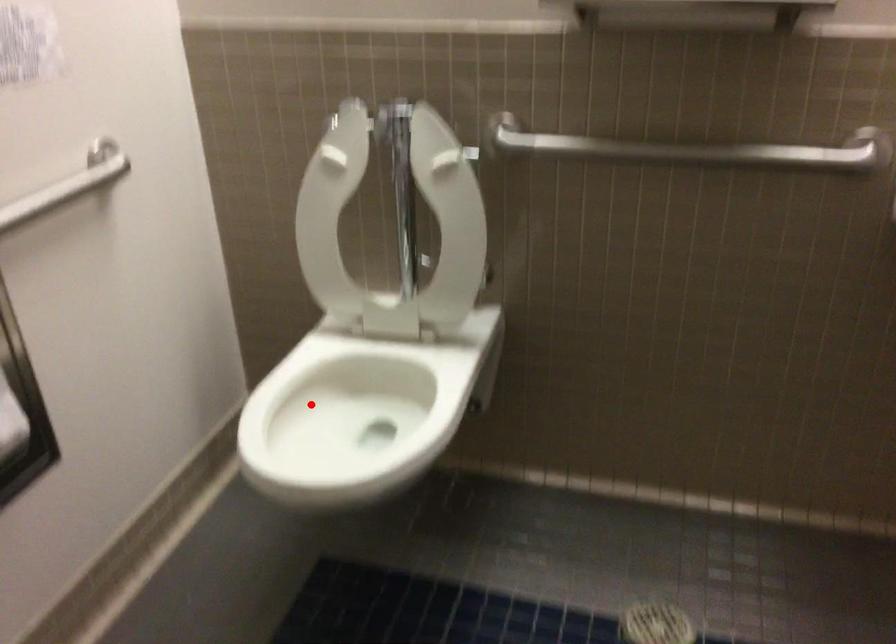
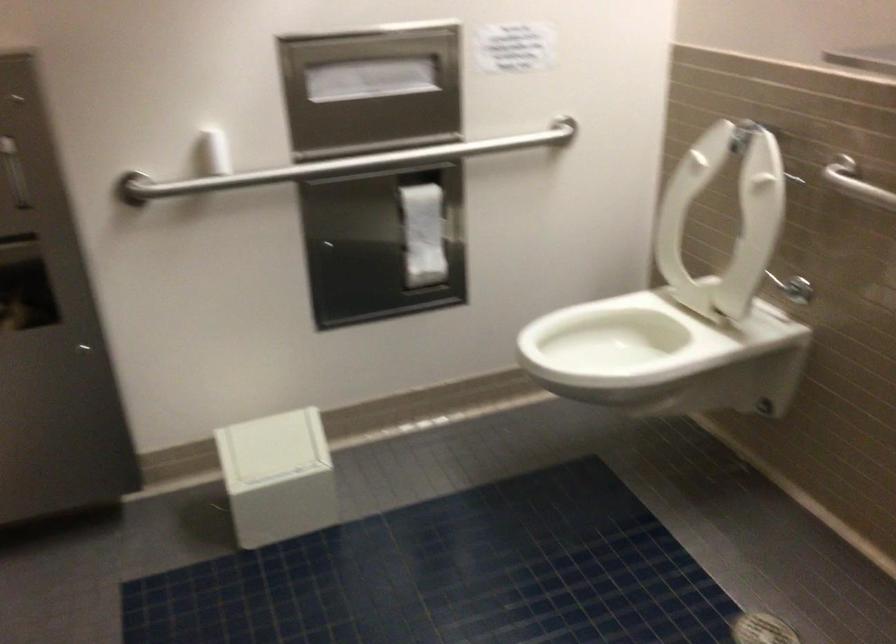
In the second image, find the point that corresponds to the highlighted location in the first image.

(616, 336)